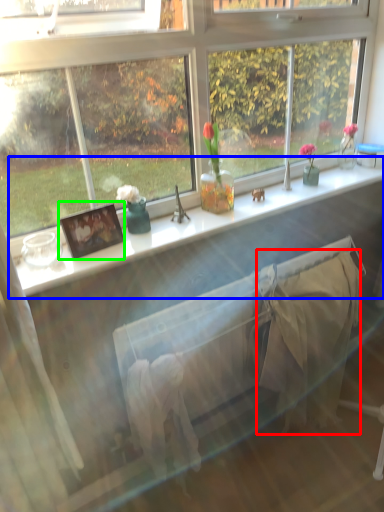
Question: Which object is the closest to the blanket (highlighted by a red box)? Choose among these: window sill (highlighted by a blue box) or picture frame (highlighted by a green box).

Choices:
 (A) window sill
 (B) picture frame

Answer: (A)